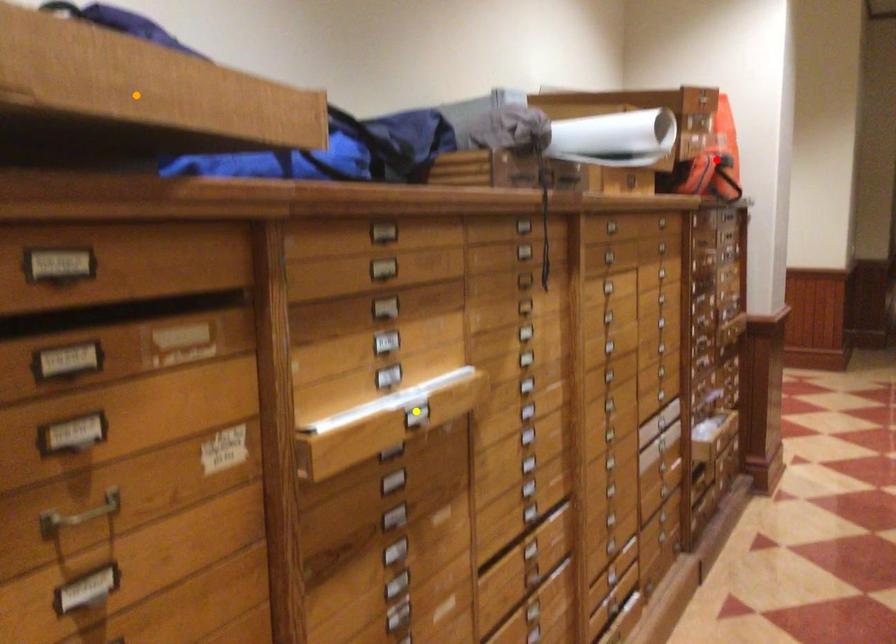
Order these from nearest to farthest:
A) red point
B) orange point
C) yellow point

orange point
yellow point
red point